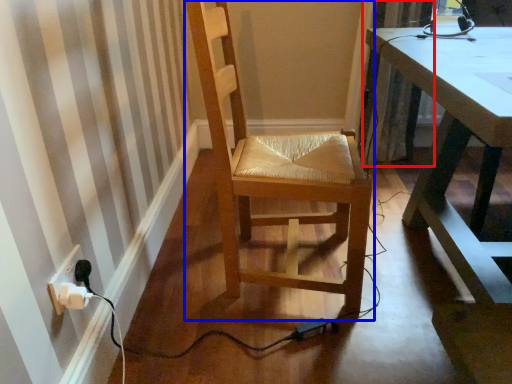
Question: Among these objects, which one is farthest to the camera, curtain (highlighted by a red box) or chair (highlighted by a blue box)?

Choices:
 (A) curtain
 (B) chair

Answer: (A)